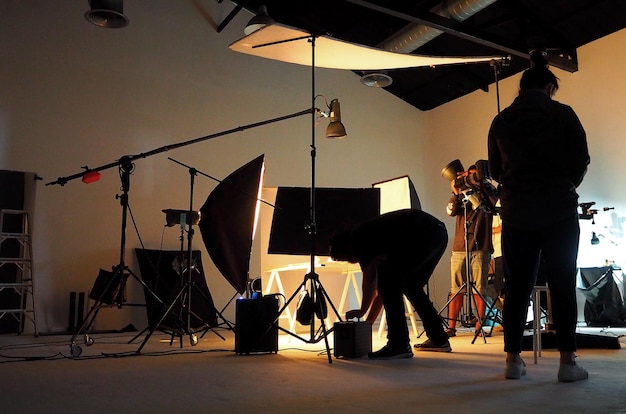
I want to click on top of the corner of two walls, so click(422, 111).